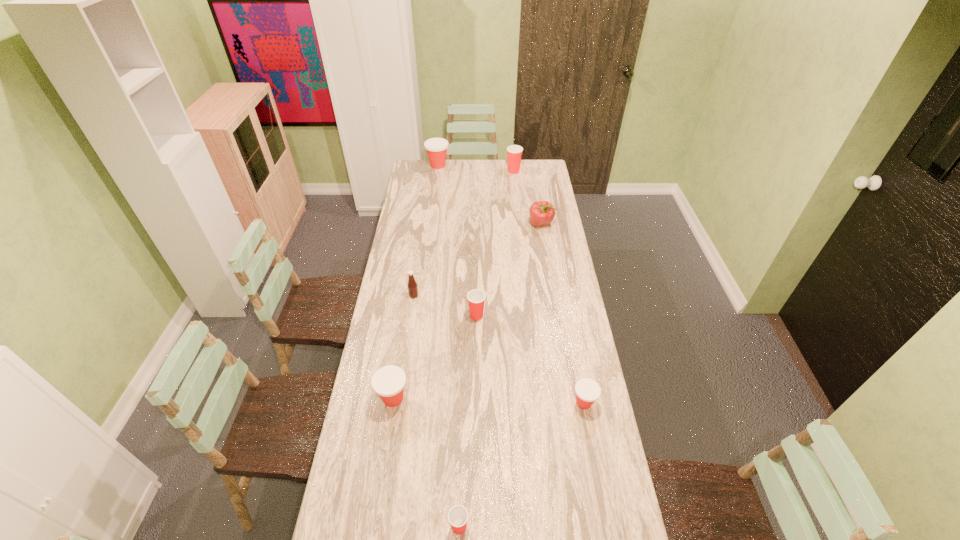
Identify the location of the biggest red-orange Dixie cup. (436, 148).

Where is `the third object from right to left`? This screenshot has height=540, width=960. the third object from right to left is located at coordinates (514, 152).

In order to click on the rightmost red Dixie cup in this screenshot , I will do `click(514, 152)`.

You are a GUI agent. You are given a task and a screenshot of the screen. Output one action in this format:
    pyautogui.click(x=<x>, y=<y>)
    Task: Click on the Tabasco sauce
    Image resolution: width=960 pixels, height=540 pixels.
    Given the screenshot: What is the action you would take?
    pyautogui.click(x=412, y=285)

Where is `white Tabasco sauce`? The height and width of the screenshot is (540, 960). white Tabasco sauce is located at coordinates (412, 285).

Identify the location of pink bell pepper. This screenshot has width=960, height=540. (542, 213).

Where is `bell pepper`? bell pepper is located at coordinates (542, 213).

At what (x,y) coordinates should I click in order to perform the action: click on the second smallest red-orange Dixie cup. Please return your answer as a coordinate pair (x, y). Image resolution: width=960 pixels, height=540 pixels. Looking at the image, I should click on (388, 382).

I want to click on the second smallest red Dixie cup, so click(x=476, y=298).

Identify the location of the third farthest Dixie cup. The width and height of the screenshot is (960, 540). (476, 298).